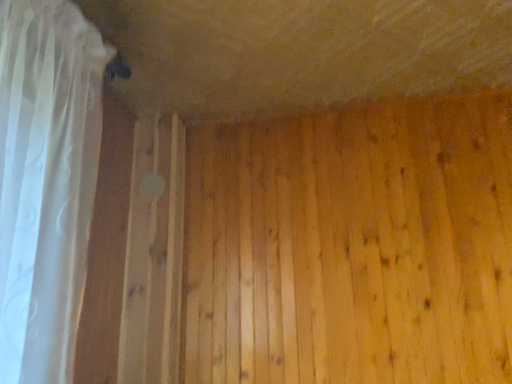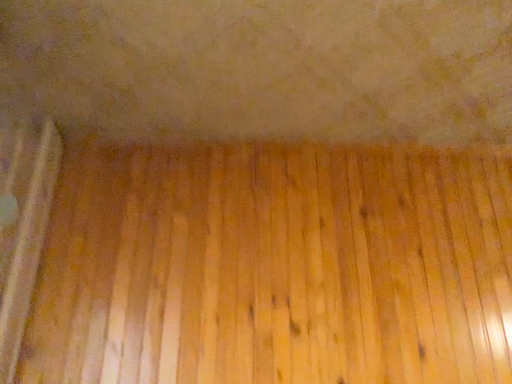
Question: Which way did the camera rotate in the video?

Choices:
 (A) rotated left
 (B) rotated right

Answer: (B)